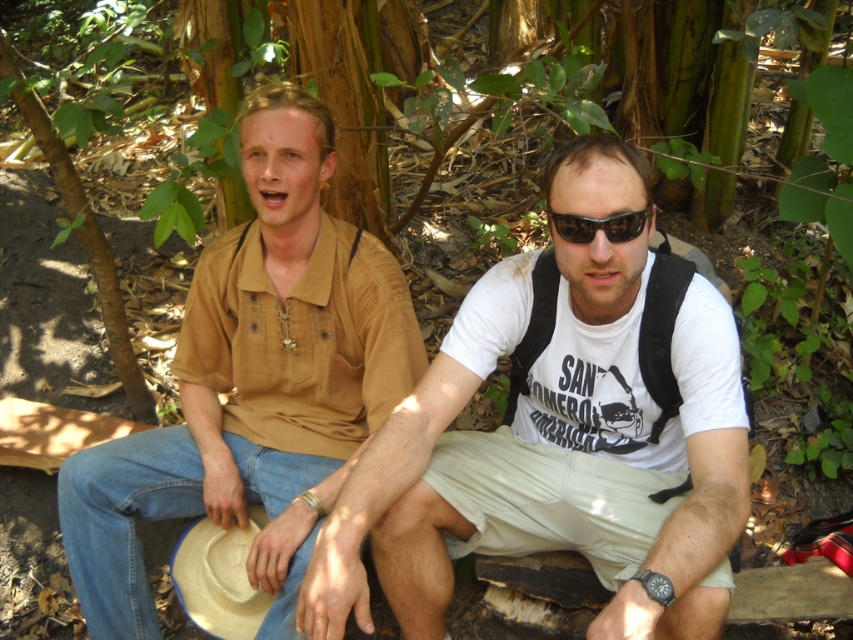
From the picture: You are standing in the forest scene and want to place a small flag at the point closer to you. Which point should you choose between point (x=635, y=596) and point (x=640, y=230)?

You should choose point (x=635, y=596) because it is closer to the viewer than point (x=640, y=230).